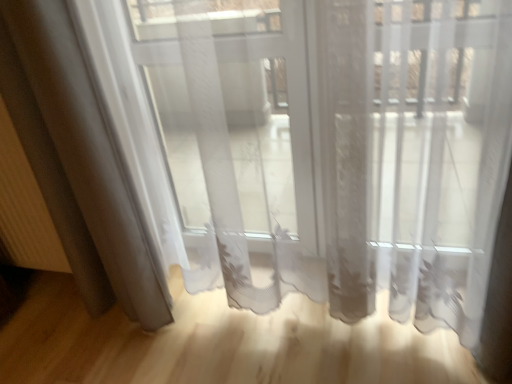
Describe the element at coordinates (25, 208) in the screenshot. I see `brown ribbed radiator at lower left` at that location.

Find the location of a particular element. The height and width of the screenshot is (384, 512). brown ribbed radiator at lower left is located at coordinates (25, 208).

Locate an element on the screen. The image size is (512, 384). brown ribbed radiator at lower left is located at coordinates (25, 208).